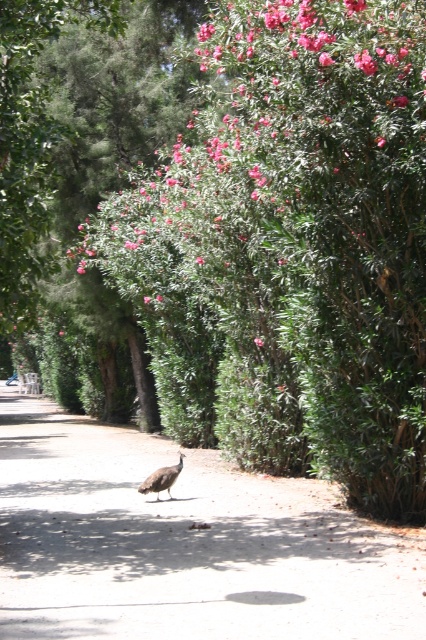
You are a GUI agent. You are given a task and a screenshot of the screen. Output one action in this format:
    pyautogui.click(x=<x>, y=<y>)
    Task: Click on the brown dirt path at center
    This screenshot has width=426, height=640.
    Given the screenshot: What is the action you would take?
    pyautogui.click(x=184, y=545)

Between brown dirt path at center and gray feathered peacock at center, which one has less height?

gray feathered peacock at center is shorter.

In order to click on brown dirt path at center in this screenshot , I will do `click(184, 545)`.

Find the location of a particular element. This screenshot has height=640, width=426. brown dirt path at center is located at coordinates (184, 545).

Is gray feathered peacock at center shorter than pink matte flower at upper center?

No.

Does gray feathered peacock at center appear over pink matte flower at upper center?

No.

Who is more forward, (157, 486) or (259, 340)?

Point (157, 486) is more forward.

Where is `gray feathered peacock at center`? The height and width of the screenshot is (640, 426). gray feathered peacock at center is located at coordinates (161, 477).

Which is below, brown dirt path at center or pink matte flower at upper center?

brown dirt path at center is below.

Is brown dirt path at center shorter than pink matte flower at upper center?

In fact, brown dirt path at center may be taller than pink matte flower at upper center.

Where is `brown dirt path at center`? Image resolution: width=426 pixels, height=640 pixels. brown dirt path at center is located at coordinates (184, 545).